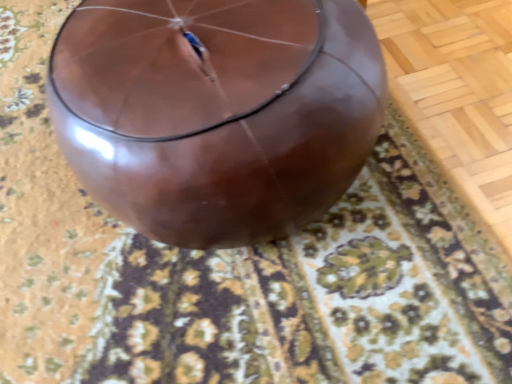
The width and height of the screenshot is (512, 384). Describe the element at coordinates (318, 294) in the screenshot. I see `brown glossy mat at center` at that location.

At what (x,y) coordinates should I click in order to perform the action: click on brown glossy mat at center. Please return your answer as a coordinate pair (x, y). Looking at the image, I should click on (318, 294).

The width and height of the screenshot is (512, 384). In order to click on glossy brown balloon at center in this screenshot , I will do `click(216, 112)`.

What do you see at coordinates (216, 112) in the screenshot?
I see `glossy brown balloon at center` at bounding box center [216, 112].

Identify the location of brown glossy mat at center. coord(318,294).

Which is more to the right, glossy brown balloon at center or brown glossy mat at center?

Positioned to the right is glossy brown balloon at center.

Considering the relative positions of glossy brown balloon at center and brown glossy mat at center in the image provided, is glossy brown balloon at center in front of brown glossy mat at center?

Yes, glossy brown balloon at center is in front of brown glossy mat at center.

Between point (251, 194) and point (297, 331), which one is positioned in front?

The point (251, 194) is closer to the camera.

From the image's perspective, is glossy brown balloon at center positioned above or below brown glossy mat at center?

Clearly, from the image's perspective, glossy brown balloon at center is below brown glossy mat at center.

From a real-world perspective, is glossy brown balloon at center positioned above or below brown glossy mat at center?

From a real-world perspective, glossy brown balloon at center is physically above brown glossy mat at center.

In the scene shown: Considering the sizes of objects glossy brown balloon at center and brown glossy mat at center in the image provided, who is wider, glossy brown balloon at center or brown glossy mat at center?

Wider between the two is brown glossy mat at center.

In the scene shown: Who is shorter, glossy brown balloon at center or brown glossy mat at center?

brown glossy mat at center is shorter.

Between glossy brown balloon at center and brown glossy mat at center, which one has smaller size?

brown glossy mat at center.

Is brown glossy mat at center inside glossy brown balloon at center?

No, brown glossy mat at center is not a part of glossy brown balloon at center.

Are glossy brown balloon at center and brown glossy mat at center beside each other?

No, glossy brown balloon at center is not in contact with brown glossy mat at center.

Is glossy brown balloon at center looking in the opposite direction of brown glossy mat at center?

No.

Where is `balloon that is below the brown glossy mat at center (from the image's perspective)`? balloon that is below the brown glossy mat at center (from the image's perspective) is located at coordinates (216, 112).

Between brown glossy mat at center and glossy brown balloon at center, which one appears on the right side from the viewer's perspective?

Positioned to the right is glossy brown balloon at center.

Is brown glossy mat at center positioned before glossy brown balloon at center?

No, brown glossy mat at center is further to the viewer.

Is point (429, 199) closer or farther from the camera than point (134, 210)?

Point (429, 199).

From the image's perspective, is brown glossy mat at center over glossy brown balloon at center?

Yes.

From a real-world perspective, relative to glossy brown balloon at center, is brown glossy mat at center vertically above or below?

brown glossy mat at center is below glossy brown balloon at center.

Between brown glossy mat at center and glossy brown balloon at center, which one has smaller width?

glossy brown balloon at center.

Does brown glossy mat at center have a greater height compared to glossy brown balloon at center?

No.

Between brown glossy mat at center and glossy brown balloon at center, which one has smaller size?

With smaller size is brown glossy mat at center.

Can we say brown glossy mat at center lies outside glossy brown balloon at center?

brown glossy mat at center is positioned outside glossy brown balloon at center.

Is brown glossy mat at center with glossy brown balloon at center?

No, brown glossy mat at center is not making contact with glossy brown balloon at center.

Is brown glossy mat at center oriented towards glossy brown balloon at center?

No, brown glossy mat at center is not aimed at glossy brown balloon at center.

Where is `mat lying above the glossy brown balloon at center (from the image's perspective)`? The width and height of the screenshot is (512, 384). mat lying above the glossy brown balloon at center (from the image's perspective) is located at coordinates (318, 294).

You are a GUI agent. You are given a task and a screenshot of the screen. Output one action in this format:
    pyautogui.click(x=<x>, y=<y>)
    Task: Click on the mat above the glossy brown balloon at center (from the image's perspective)
    Image resolution: width=512 pixels, height=384 pixels.
    Given the screenshot: What is the action you would take?
    pyautogui.click(x=318, y=294)

Find the location of a particular element. The width and height of the screenshot is (512, 384). balloon below the brown glossy mat at center (from the image's perspective) is located at coordinates (216, 112).